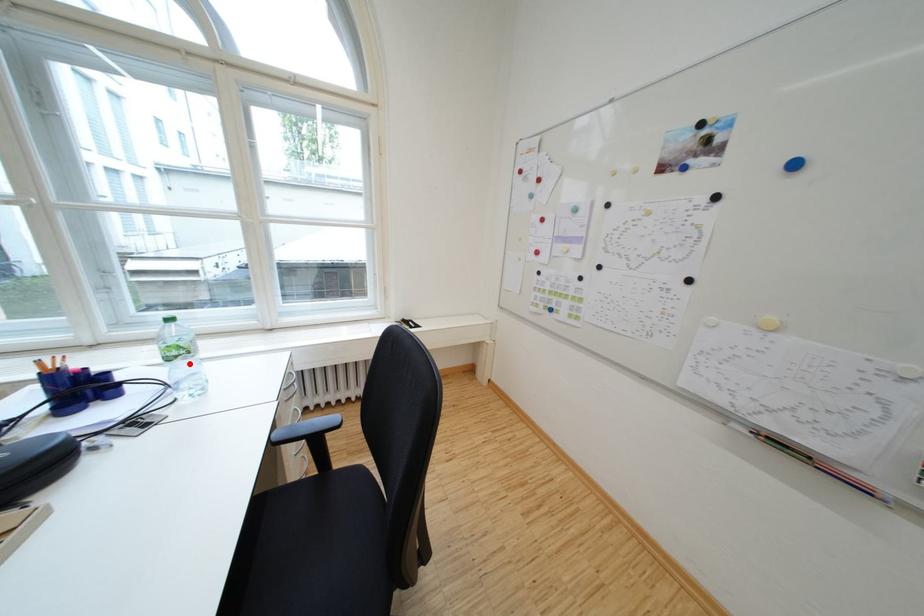
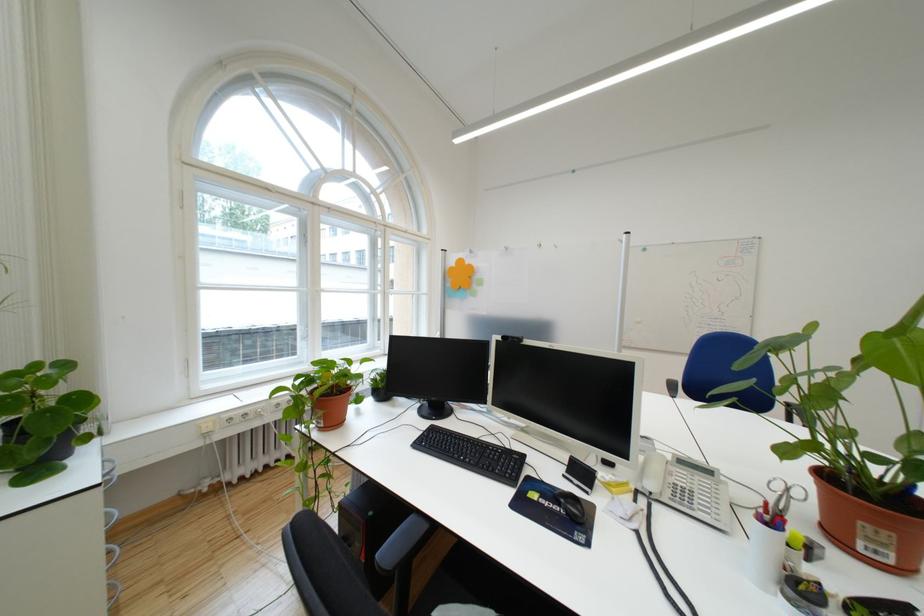
Question: I am providing you with two images of the same scene from different viewpoints. A red point is marked on the first image. Is the red point's position out of view in image 2?

Choices:
 (A) Yes
 (B) No

Answer: (A)